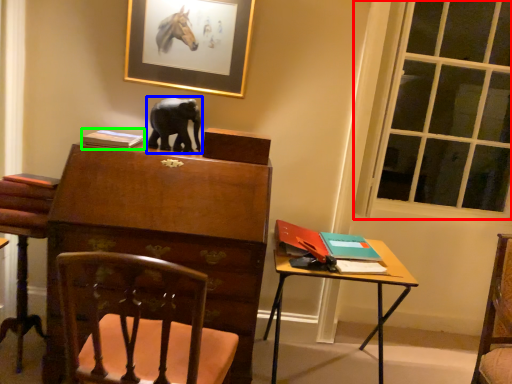
Question: Which is farther away from window (highlighted by a red box)? elephant (highlighted by a blue box) or book (highlighted by a green box)?

Choices:
 (A) elephant
 (B) book

Answer: (B)